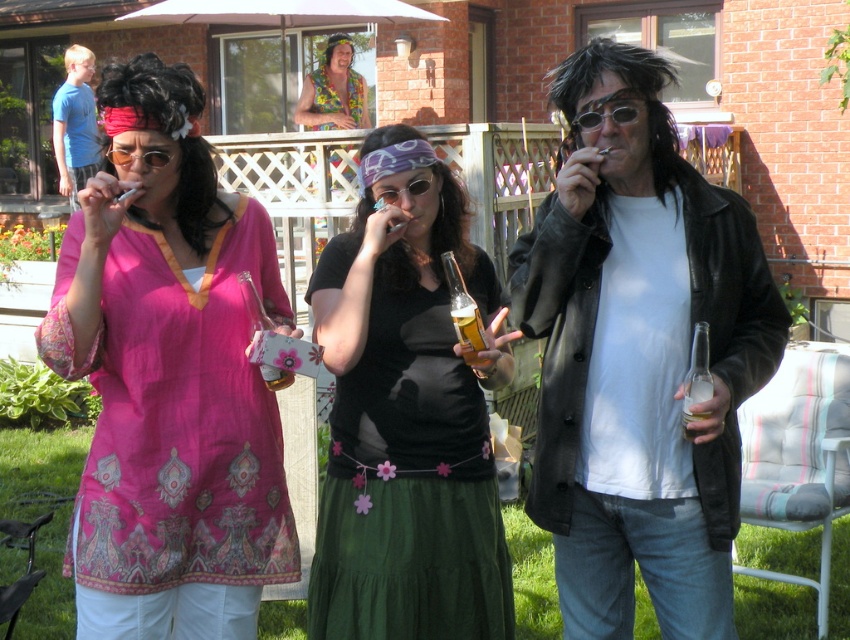
Question: Does floral fabric shirt at upper center lie in front of translucent glass beer at center?

Choices:
 (A) yes
 (B) no

Answer: (B)

Question: Which point is closer to the camera taking this photo?

Choices:
 (A) 680,259
 (B) 207,435
 (C) 585,122

Answer: (C)

Question: Which object appears closest to the camera in this image?

Choices:
 (A) pink fabric shirt at center
 (B) matte black jacket at center
 (C) shiny black sunglasses at center
 (D) floral fabric shirt at upper center

Answer: (B)

Question: In this image, where is matte black shirt at center located relative to shiny black sunglasses at center?

Choices:
 (A) left
 (B) right

Answer: (A)

Question: Is pink fabric shirt at center further to the viewer compared to floral fabric shirt at upper center?

Choices:
 (A) no
 (B) yes

Answer: (A)

Question: Estimate the real-world distances between objects in this image. Which object is closer to the floral fabric shirt at upper center?

Choices:
 (A) translucent glass beer at center
 (B) blue t-shirt at left
 (C) matte black jacket at center
 (D) shiny black sunglasses at center

Answer: (B)